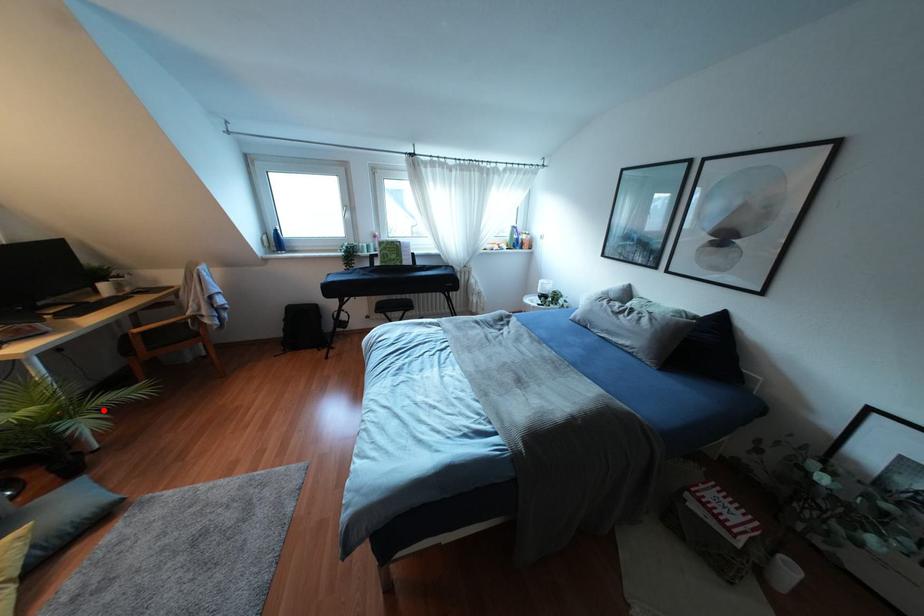
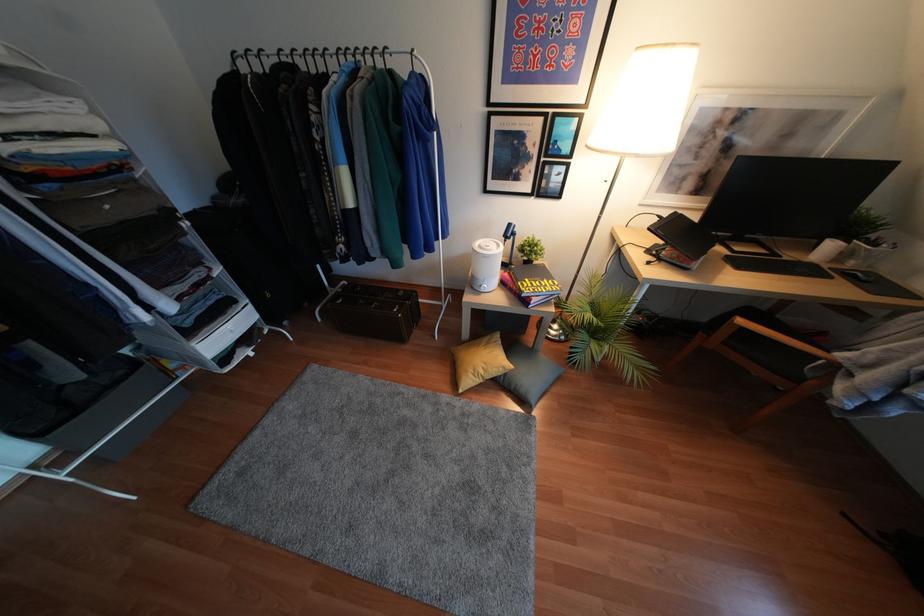
Question: I am providing you with two images of the same scene from different viewpoints. A red point is marked on the first image. At the location where the point appears in image 1, is it still visible in image 2?

Choices:
 (A) Yes
 (B) No

Answer: (A)